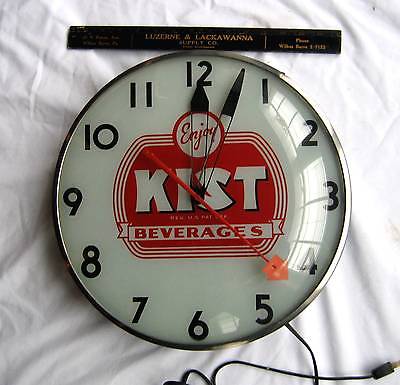
At what (x,y) coordinates should I click in order to perform the action: click on rim of clock. Please return your answer as a coordinate pair (x, y). Looking at the image, I should click on (139, 66), (232, 344).